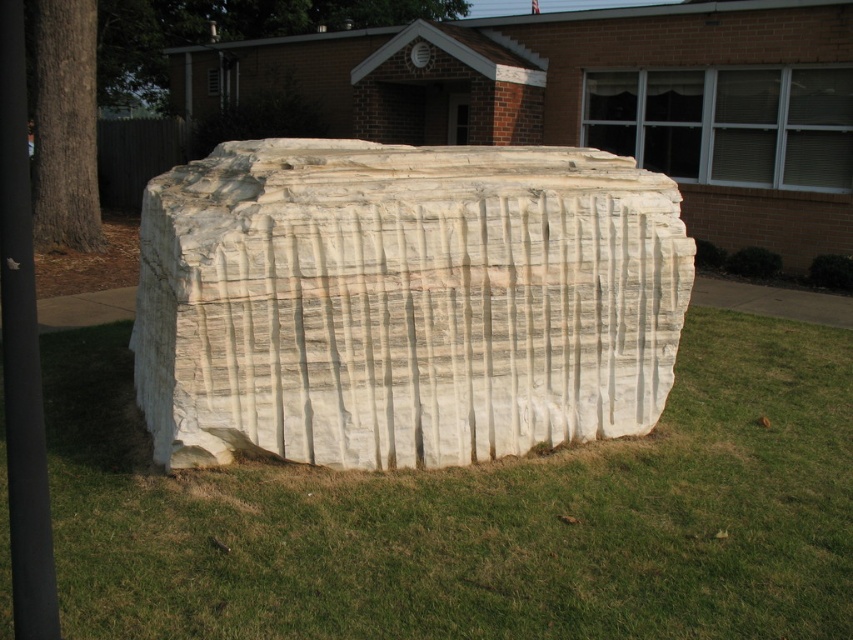
Question: Can you confirm if green grass at lower center is thinner than black plastic pole at left?

Choices:
 (A) yes
 (B) no

Answer: (B)

Question: Considering the relative positions of green grass at lower center and black plastic pole at left in the image provided, where is green grass at lower center located with respect to black plastic pole at left?

Choices:
 (A) below
 (B) above

Answer: (A)

Question: Which of the following is the farthest from the observer?

Choices:
 (A) white marble rock at center
 (B) black plastic pole at left

Answer: (A)

Question: Where is white marble rock at center located in relation to black plastic pole at left in the image?

Choices:
 (A) left
 (B) right

Answer: (B)

Question: Among these objects, which one is farthest from the camera?

Choices:
 (A) white marble rock at center
 (B) green grass at lower center

Answer: (A)

Question: Which of these objects is positioned farthest from the green grass at lower center?

Choices:
 (A) white marble rock at center
 (B) black plastic pole at left

Answer: (B)